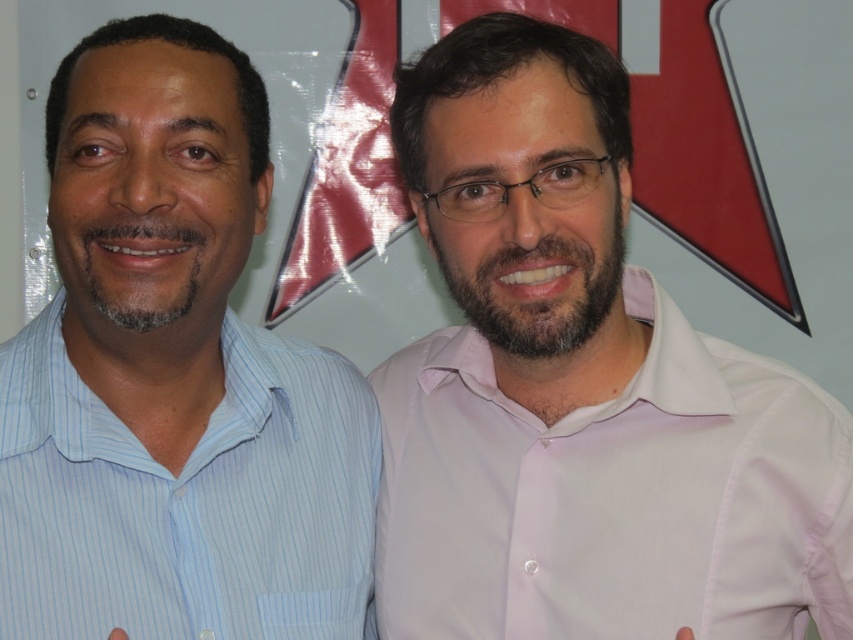
Looking at this image, you are taking a photo of two people wearing shirts. The person on the left has a blue striped shirt at left, and the person on the right has a pink smooth shirt at right. Which shirt is positioned higher in the image?

The pink smooth shirt at right is positioned higher in the image because it is above the blue striped shirt at left according to the description.